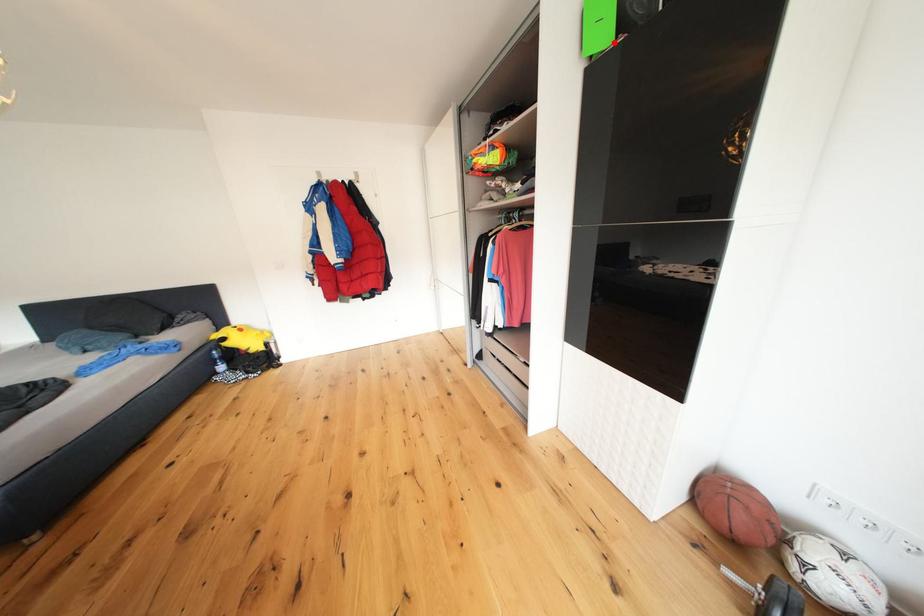
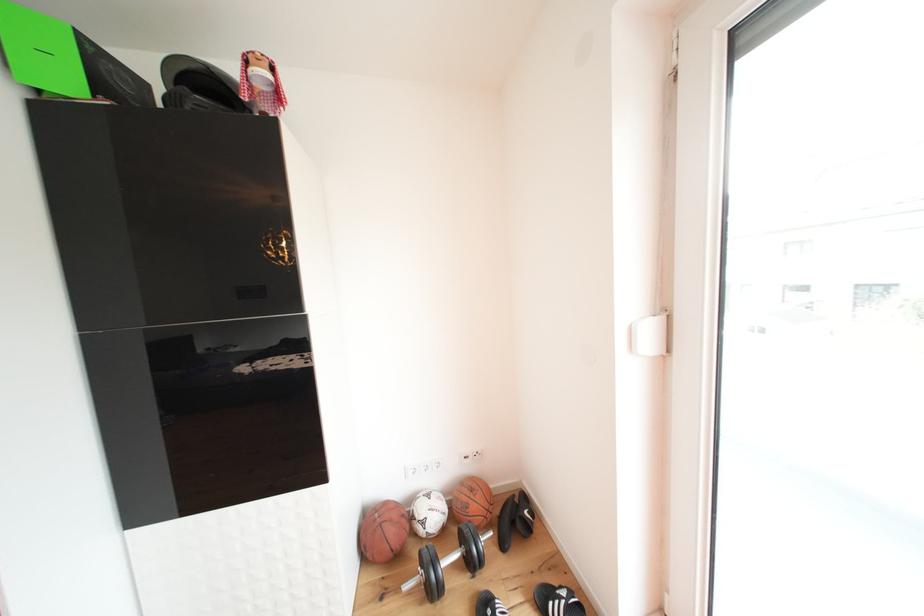
In the second image, find the point that corresponds to the highlighted location in the first image.

(76, 87)